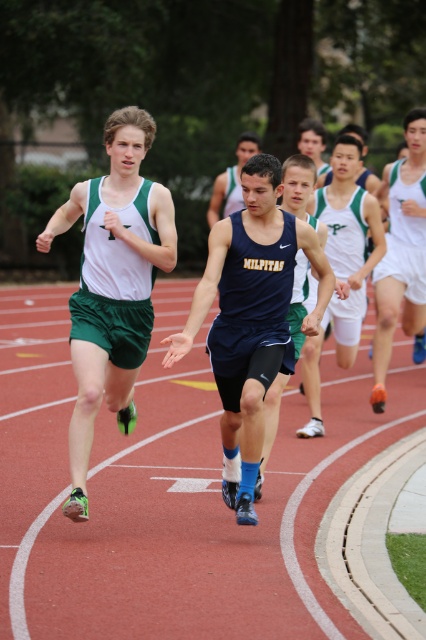
Question: Estimate the real-world distances between objects in this image. Which object is closer to the navy blue athletic tank top at center?

Choices:
 (A) dark blue athletic uniform at center
 (B) white matte shorts at right
 (C) matte green shorts at center
 (D) matte green shorts at left

Answer: (D)

Question: Which point is closer to the camera?

Choices:
 (A) (100, 289)
 (B) (317, 413)
 (C) (316, 128)

Answer: (A)

Question: Is red rubber track at center to the left of white matte shorts at right from the viewer's perspective?

Choices:
 (A) yes
 (B) no

Answer: (A)

Question: Which is nearer to the white matte shorts at right?

Choices:
 (A) red rubber track at center
 (B) white athletic uniform at center

Answer: (B)

Question: Can you confirm if white matte shorts at right is positioned below matte green shorts at center?

Choices:
 (A) no
 (B) yes

Answer: (B)

Question: Considering the relative positions of matte green shorts at left and white athletic uniform at center in the image provided, where is matte green shorts at left located with respect to white athletic uniform at center?

Choices:
 (A) left
 (B) right

Answer: (A)